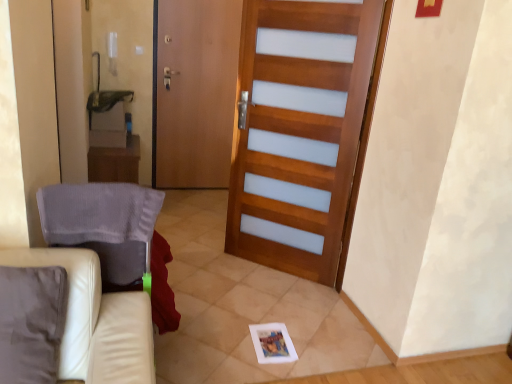
Find the location of a particular element. The height and width of the screenshot is (384, 512). wooden barn door at center is located at coordinates [298, 131].

Find the location of a particular element. wooden table at left is located at coordinates (113, 157).

Where is `wooden barn door at center`? wooden barn door at center is located at coordinates (298, 131).

Is wooden screen door at center looking in the opposite direction of wooden barn door at center?

That's not correct — wooden screen door at center is not looking away from wooden barn door at center.

Does point (192, 178) appear closer or farther from the camera than point (322, 48)?

Point (192, 178) is positioned farther from the camera compared to point (322, 48).

Between wooden screen door at center and wooden barn door at center, which one has less height?

wooden barn door at center.

Can you confirm if gray fabric armchair at left is bigger than white leather couch at lower left?

Actually, gray fabric armchair at left might be smaller than white leather couch at lower left.

Considering the relative sizes of gray fabric armchair at left and white leather couch at lower left in the image provided, is gray fabric armchair at left wider than white leather couch at lower left?

Incorrect, the width of gray fabric armchair at left does not surpass that of white leather couch at lower left.

Is white leather couch at lower left a part of gray fabric armchair at left?

No, gray fabric armchair at left does not contain white leather couch at lower left.

From the image's perspective, is gray fabric armchair at left above or below white leather couch at lower left?

From the image's perspective, gray fabric armchair at left appears above white leather couch at lower left.

Which object is further away from the camera, wooden table at left or gray fabric armchair at left?

wooden table at left.

Measure the distance from wooden table at left to gray fabric armchair at left.

The distance of wooden table at left from gray fabric armchair at left is 6.26 feet.

Which object is thinner, wooden table at left or gray fabric armchair at left?

Thinner between the two is gray fabric armchair at left.

Which of these two, wooden table at left or gray fabric armchair at left, stands shorter?

gray fabric armchair at left.

Is point (326, 164) positioned before point (173, 154)?

That is True.

Considering the sizes of objects wooden barn door at center and wooden screen door at center in the image provided, who is taller, wooden barn door at center or wooden screen door at center?

With more height is wooden screen door at center.

How different are the orientations of wooden barn door at center and wooden screen door at center in degrees?

wooden barn door at center and wooden screen door at center are facing 25.7 degrees away from each other.

In the scene shown: Could wooden screen door at center be considered to be inside wooden barn door at center?

No, wooden screen door at center is not surrounded by wooden barn door at center.

Can you confirm if wooden screen door at center is positioned to the left of wooden table at left?

No.

Relative to wooden table at left, is wooden screen door at center in front or behind?

Clearly, wooden screen door at center is behind wooden table at left.

Is wooden table at left inside wooden screen door at center?

No, wooden table at left is not inside wooden screen door at center.

Who is shorter, white leather couch at lower left or gray fabric armchair at left?

gray fabric armchair at left.

In the scene shown: Is gray fabric armchair at left at the back of white leather couch at lower left?

Yes, white leather couch at lower left is positioned with its back facing gray fabric armchair at left.

Which of these two, white leather couch at lower left or gray fabric armchair at left, is thinner?

With smaller width is gray fabric armchair at left.

Can you confirm if wooden barn door at center is smaller than white leather couch at lower left?

No.

From the image's perspective, who appears lower, wooden barn door at center or white leather couch at lower left?

white leather couch at lower left is shown below in the image.

Measure the distance from wooden barn door at center to white leather couch at lower left.

The distance of wooden barn door at center from white leather couch at lower left is 1.56 meters.

Choose the correct answer: Is wooden barn door at center inside white leather couch at lower left or outside it?

wooden barn door at center exists outside the volume of white leather couch at lower left.

Find the location of a particular element. The height and width of the screenshot is (384, 512). screen door above the wooden barn door at center (from the image's perspective) is located at coordinates (195, 91).

I want to click on armchair that appears on the right of white leather couch at lower left, so click(103, 224).

Based on their spatial positions, is white leather couch at lower left or wooden table at left further from wooden barn door at center?

white leather couch at lower left lies further to wooden barn door at center than the other object.

Based on their spatial positions, is wooden table at left or wooden screen door at center closer to gray fabric armchair at left?

wooden table at left lies closer to gray fabric armchair at left than the other object.

From the image, which object appears to be nearer to wooden screen door at center, white leather couch at lower left or gray fabric armchair at left?

gray fabric armchair at left lies closer to wooden screen door at center than the other object.

Considering their positions, is wooden barn door at center positioned closer to gray fabric armchair at left than wooden table at left?

Based on the image, wooden barn door at center appears to be nearer to gray fabric armchair at left.

In the scene shown: Estimate the real-world distances between objects in this image. Which object is further from wooden barn door at center, white leather couch at lower left or wooden screen door at center?

white leather couch at lower left lies further to wooden barn door at center than the other object.

From the image, which object appears to be nearer to wooden table at left, white leather couch at lower left or wooden barn door at center?

The object closer to wooden table at left is wooden barn door at center.

Estimate the real-world distances between objects in this image. Which object is closer to wooden barn door at center, gray fabric armchair at left or white leather couch at lower left?

Based on the image, gray fabric armchair at left appears to be nearer to wooden barn door at center.

From the image, which object appears to be farther from wooden barn door at center, wooden screen door at center or white leather couch at lower left?

Among the two, white leather couch at lower left is located further to wooden barn door at center.

The image size is (512, 384). What are the coordinates of `armchair between white leather couch at lower left and wooden barn door at center from front to back` in the screenshot? It's located at (103, 224).

Where is `barn door between gray fabric armchair at left and wooden screen door at center along the z-axis`? Image resolution: width=512 pixels, height=384 pixels. barn door between gray fabric armchair at left and wooden screen door at center along the z-axis is located at coordinates (298, 131).

Find the location of a particular element. The width and height of the screenshot is (512, 384). barn door positioned between white leather couch at lower left and wooden screen door at center from near to far is located at coordinates (298, 131).

Find the location of a particular element. The width and height of the screenshot is (512, 384). table between white leather couch at lower left and wooden screen door at center along the z-axis is located at coordinates (113, 157).